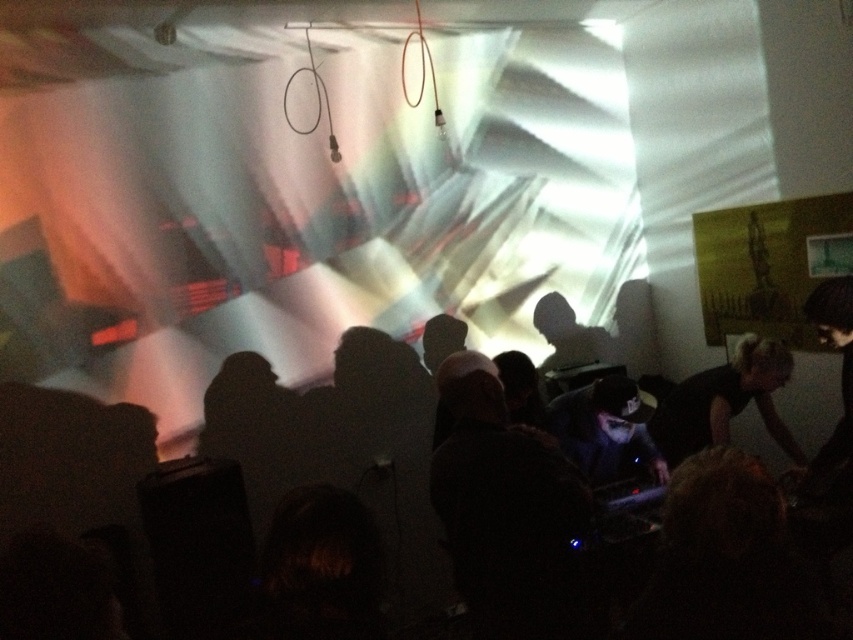
Question: Which of the following is the farthest from the observer?

Choices:
 (A) black matte shirt at right
 (B) dark hair at center

Answer: (B)

Question: Does dark hair at center appear on the left side of black matte shirt at right?

Choices:
 (A) yes
 (B) no

Answer: (A)

Question: Which point appears closest to the camera in this image?

Choices:
 (A) (361, 371)
 (B) (741, 356)

Answer: (B)

Question: Does dark hair at center come in front of black matte shirt at right?

Choices:
 (A) yes
 (B) no

Answer: (B)

Question: Considering the relative positions of dark hair at center and black matte shirt at right in the image provided, where is dark hair at center located with respect to black matte shirt at right?

Choices:
 (A) left
 (B) right

Answer: (A)